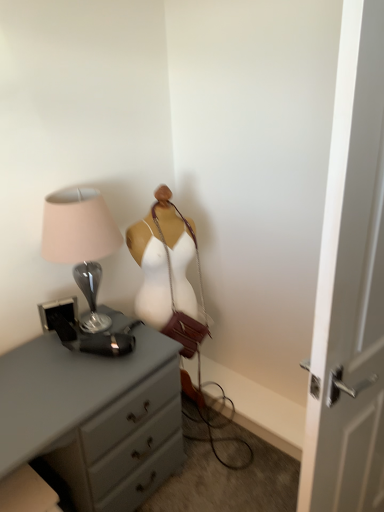
This screenshot has width=384, height=512. In order to click on free space above gray matte chest of drawers at left (from a real-world perspective) in this screenshot , I will do `click(55, 376)`.